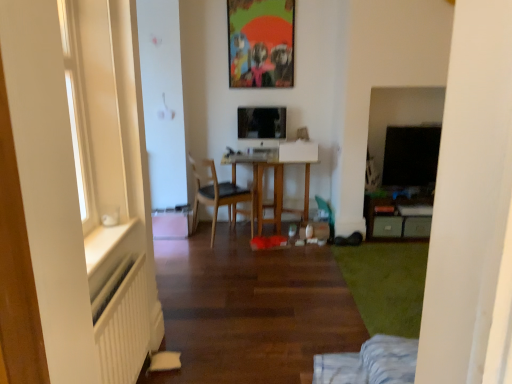
What do you see at coordinates (124, 329) in the screenshot? I see `white ribbed radiator at lower left` at bounding box center [124, 329].

Where is `matte plastic picture frame at upper center`? The width and height of the screenshot is (512, 384). matte plastic picture frame at upper center is located at coordinates [261, 42].

Identify the location of black glossy tv at right. Image resolution: width=512 pixels, height=384 pixels. (411, 156).

Identify the location of wooden chair at center. The height and width of the screenshot is (384, 512). (214, 192).

Does wooden table at center appear on the right side of matte plastic picture frame at upper center?

Indeed, wooden table at center is positioned on the right side of matte plastic picture frame at upper center.

From the image's perspective, is wooden table at center over matte plastic picture frame at upper center?

No, from the image's perspective, wooden table at center is not over matte plastic picture frame at upper center.

Is point (284, 162) in front of point (229, 39)?

Yes, point (284, 162) is closer to viewer.

Is wooden table at center in front of or behind matte plastic picture frame at upper center in the image?

Visually, wooden table at center is located in front of matte plastic picture frame at upper center.

Based on the photo, measure the distance from black glossy tv at right to white ribbed radiator at lower left.

black glossy tv at right is 9.23 feet from white ribbed radiator at lower left.

Which is more to the right, black glossy tv at right or white ribbed radiator at lower left?

Positioned to the right is black glossy tv at right.

From the image's perspective, between black glossy tv at right and white ribbed radiator at lower left, who is located below?

From the image's view, white ribbed radiator at lower left is below.

Can we say black glossy tv at right lies outside white ribbed radiator at lower left?

Yes, black glossy tv at right is not within white ribbed radiator at lower left.

Is wooden chair at center outside of wooden table at center?

Absolutely, wooden chair at center is external to wooden table at center.

Which of these two, wooden chair at center or wooden table at center, stands taller?

wooden chair at center is taller.

From the image's perspective, is wooden chair at center positioned above or below wooden table at center?

Based on their image positions, wooden chair at center is located beneath wooden table at center.

Which is closer, [231,38] or [194,168]?

The point [194,168] is closer.

Does matte plastic picture frame at upper center have a lesser height compared to wooden chair at center?

Yes, matte plastic picture frame at upper center is shorter than wooden chair at center.

Could you tell me if matte plastic picture frame at upper center is turned towards wooden chair at center?

No, matte plastic picture frame at upper center does not turn towards wooden chair at center.

In terms of width, does matte plastic picture frame at upper center look wider or thinner when compared to wooden chair at center?

matte plastic picture frame at upper center is thinner than wooden chair at center.

From a real-world perspective, is wooden table at center on top of black glossy tv at right?

No, from a real-world perspective, wooden table at center is not above black glossy tv at right.

Is the position of wooden table at center less distant than that of black glossy tv at right?

That is True.

Does wooden table at center touch black glossy tv at right?

No, wooden table at center is not next to black glossy tv at right.

The height and width of the screenshot is (384, 512). Identify the location of window screen located on the right of wooden table at center. (411, 156).

Considering the relative positions of black glossy tv at right and wooden table at center in the image provided, is black glossy tv at right to the left or to the right of wooden table at center?

Clearly, black glossy tv at right is on the right of wooden table at center in the image.

From the image's perspective, is black glossy tv at right located above or below wooden table at center?

black glossy tv at right is situated higher than wooden table at center in the image.

Is black glossy tv at right aimed at wooden table at center?

No, black glossy tv at right is not facing towards wooden table at center.

From a real-world perspective, is white ribbed radiator at lower left physically above wooden table at center?

Incorrect, from a real-world perspective, white ribbed radiator at lower left is lower than wooden table at center.

Considering the positions of objects white ribbed radiator at lower left and wooden table at center in the image provided, who is more to the right, white ribbed radiator at lower left or wooden table at center?

wooden table at center is more to the right.

Identify the location of radiator on the left side of wooden table at center. The image size is (512, 384). (124, 329).

Is white ribbed radiator at lower left directly adjacent to wooden table at center?

No, white ribbed radiator at lower left is not touching wooden table at center.

Where is `picture frame that appears behind the wooden table at center`? This screenshot has width=512, height=384. picture frame that appears behind the wooden table at center is located at coordinates (261, 42).

This screenshot has width=512, height=384. In order to click on radiator that appears below the black glossy tv at right (from a real-world perspective) in this screenshot , I will do (x=124, y=329).

When comparing their distances from white ribbed radiator at lower left, does black glossy tv at right or wooden chair at center seem closer?

wooden chair at center.

Looking at the image, which one is located closer to black glossy tv at right, wooden chair at center or white ribbed radiator at lower left?

wooden chair at center is positioned closer to the anchor black glossy tv at right.

From the image, which object appears to be nearer to white ribbed radiator at lower left, black glossy tv at right or matte plastic picture frame at upper center?

matte plastic picture frame at upper center is closer to white ribbed radiator at lower left.

In the scene shown: When comparing their distances from white ribbed radiator at lower left, does wooden table at center or matte plastic picture frame at upper center seem further?

matte plastic picture frame at upper center lies further to white ribbed radiator at lower left than the other object.

From the image, which object appears to be nearer to white ribbed radiator at lower left, wooden chair at center or matte plastic picture frame at upper center?

Among the two, wooden chair at center is located nearer to white ribbed radiator at lower left.

Based on their spatial positions, is wooden table at center or black glossy tv at right closer to matte plastic picture frame at upper center?

wooden table at center lies closer to matte plastic picture frame at upper center than the other object.

Considering their positions, is wooden table at center positioned closer to matte plastic picture frame at upper center than wooden chair at center?

Based on the image, wooden table at center appears to be nearer to matte plastic picture frame at upper center.

Looking at this image, when comparing their distances from wooden chair at center, does black glossy tv at right or wooden table at center seem closer?

Based on the image, wooden table at center appears to be nearer to wooden chair at center.

Where is `window screen located between white ribbed radiator at lower left and matte plastic picture frame at upper center in the depth direction`? window screen located between white ribbed radiator at lower left and matte plastic picture frame at upper center in the depth direction is located at coordinates tap(411, 156).

This screenshot has width=512, height=384. Find the location of `picture frame situated between wooden chair at center and black glossy tv at right from left to right`. picture frame situated between wooden chair at center and black glossy tv at right from left to right is located at coordinates (261, 42).

In order to click on chair located between white ribbed radiator at lower left and matte plastic picture frame at upper center in the depth direction in this screenshot , I will do `click(214, 192)`.

This screenshot has height=384, width=512. Find the location of `table located between white ribbed radiator at lower left and black glossy tv at right in the depth direction`. table located between white ribbed radiator at lower left and black glossy tv at right in the depth direction is located at coordinates (273, 190).